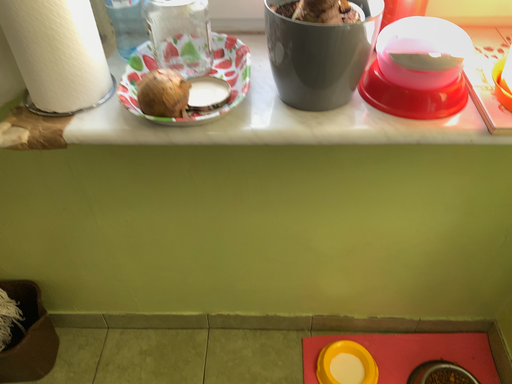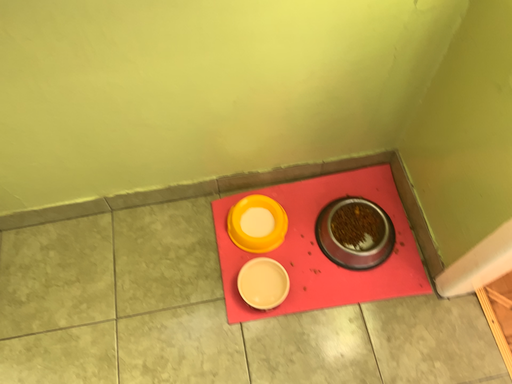
Question: How did the camera likely rotate when shooting the video?

Choices:
 (A) rotated right
 (B) rotated left

Answer: (A)